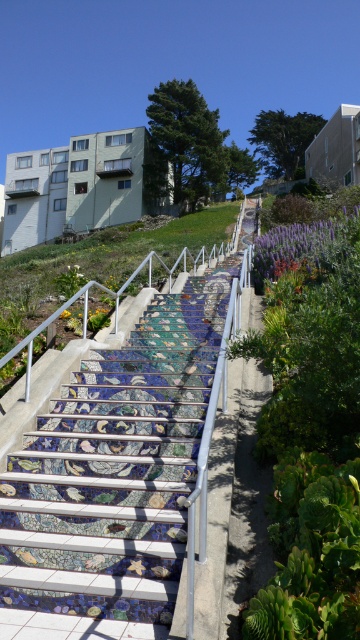
Question: Which point appears closest to the camera in this image?

Choices:
 (A) (66, 317)
 (B) (295, 227)

Answer: (A)

Question: Among these objects, which one is farthest from the camera?

Choices:
 (A) yellow matte flower at lower center
 (B) purple matte flower at upper center

Answer: (B)

Question: Is purple matte flower at upper center thinner than yellow matte flower at lower center?

Choices:
 (A) yes
 (B) no

Answer: (A)

Question: Can you confirm if mosaic tile stairs at center is wider than purple matte flower at upper center?

Choices:
 (A) yes
 (B) no

Answer: (A)

Question: Considering the real-world distances, which object is closest to the yellow matte flower at lower center?

Choices:
 (A) purple matte flower at upper center
 (B) mosaic tile stairs at center

Answer: (B)

Question: Does mosaic tile stairs at center have a lesser width compared to purple matte flower at upper center?

Choices:
 (A) no
 (B) yes

Answer: (A)